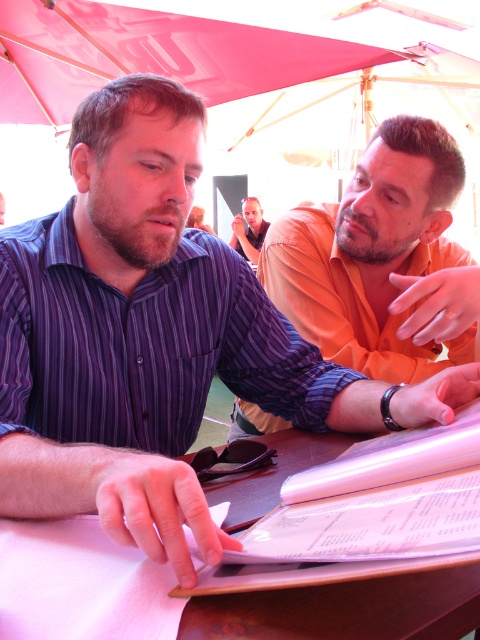
You are standing in front of the scene and want to locate the pink fabric canopy at upper center. What are its coordinates?

The pink fabric canopy at upper center is located at coordinates (153, 54).

You are at an outdoor event and see the orange matte shirt at upper right and the pink fabric canopy at upper center. Which object is positioned more to the right side of the scene?

The orange matte shirt at upper right is positioned more to the right side of the scene than the pink fabric canopy at upper center.